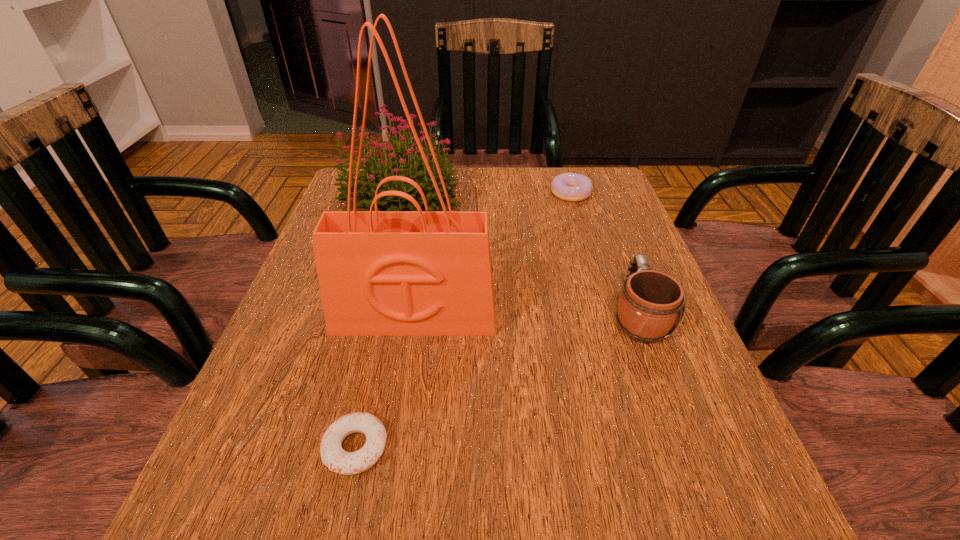
This screenshot has width=960, height=540. What are the coordinates of `free space that is in between the shorter doughnut and the tote bag` in the screenshot? It's located at (385, 382).

The width and height of the screenshot is (960, 540). Identify the location of vacant space that is in between the bouquet and the third tallest object. (518, 258).

I want to click on vacant region between the fourth shortest object and the right doughnut, so click(485, 198).

Where is `the closest object to the third shortest object`? This screenshot has width=960, height=540. the closest object to the third shortest object is located at coordinates (381, 273).

Select which object is the second closest to the bouquet. Please provide its 2D coordinates. Your answer should be formatted as a tuple, i.e. [(x, y)], where the tuple contains the x and y coordinates of a point satisfying the conditions above.

[(572, 187)]